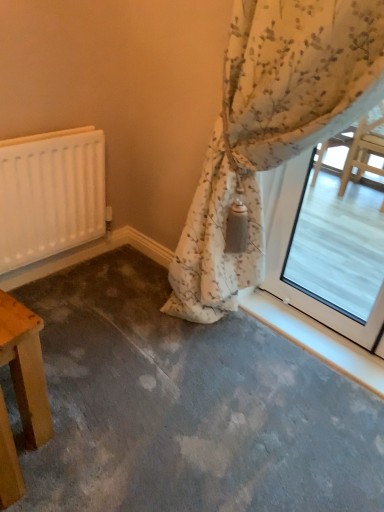
Question: Is the position of white matte radiator at left more distant than that of wooden table at lower left?

Choices:
 (A) no
 (B) yes

Answer: (B)

Question: Would you say white matte radiator at left contains wooden table at lower left?

Choices:
 (A) yes
 (B) no

Answer: (B)

Question: Is white matte radiator at left at the left side of wooden table at lower left?

Choices:
 (A) no
 (B) yes

Answer: (B)

Question: Considering the relative sizes of white matte radiator at left and wooden table at lower left in the image provided, is white matte radiator at left wider than wooden table at lower left?

Choices:
 (A) no
 (B) yes

Answer: (A)

Question: Is white matte radiator at left at the right side of wooden table at lower left?

Choices:
 (A) yes
 (B) no

Answer: (B)

Question: From the image's perspective, is wooden table at lower left positioned above or below white matte radiator at left?

Choices:
 (A) below
 (B) above

Answer: (A)

Question: In the image, is wooden table at lower left on the left side or the right side of white matte radiator at left?

Choices:
 (A) right
 (B) left

Answer: (A)

Question: From their relative heights in the image, would you say wooden table at lower left is taller or shorter than white matte radiator at left?

Choices:
 (A) tall
 (B) short

Answer: (B)

Question: From a real-world perspective, relative to white matte radiator at left, is wooden table at lower left vertically above or below?

Choices:
 (A) above
 (B) below

Answer: (B)

Question: From the image's perspective, is white matte radiator at left located above or below wooden table at lower left?

Choices:
 (A) below
 (B) above

Answer: (B)

Question: Would you say white matte radiator at left is to the left or to the right of wooden table at lower left in the picture?

Choices:
 (A) right
 (B) left

Answer: (B)

Question: Considering the positions of point (36, 218) and point (21, 373), is point (36, 218) closer or farther from the camera than point (21, 373)?

Choices:
 (A) farther
 (B) closer

Answer: (A)

Question: Relative to wooden table at lower left, is white matte radiator at left in front or behind?

Choices:
 (A) front
 (B) behind

Answer: (B)

Question: Would you say floral fabric curtain at upper right is to the left or to the right of white matte radiator at left in the picture?

Choices:
 (A) left
 (B) right

Answer: (B)

Question: From the image's perspective, relative to white matte radiator at left, is floral fabric curtain at upper right above or below?

Choices:
 (A) below
 (B) above

Answer: (A)